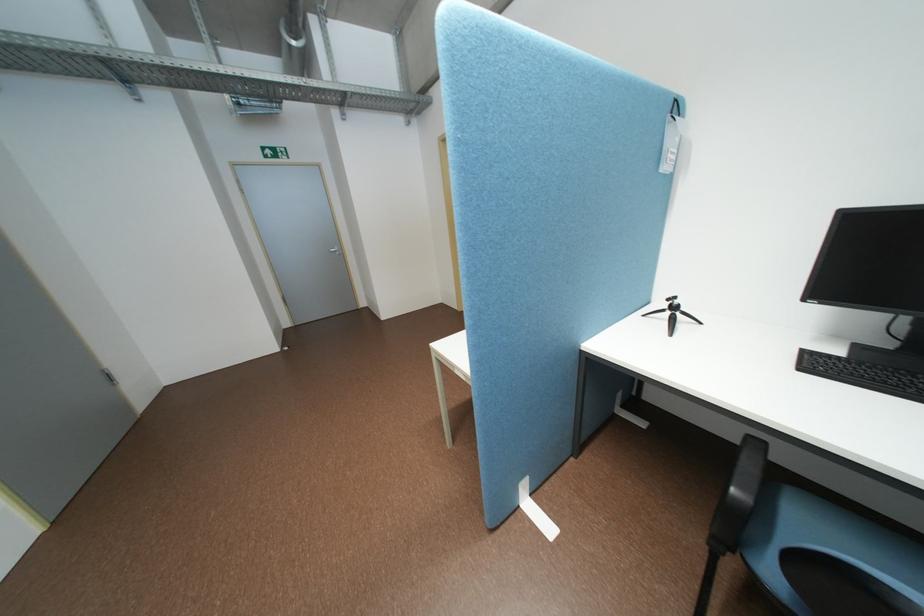
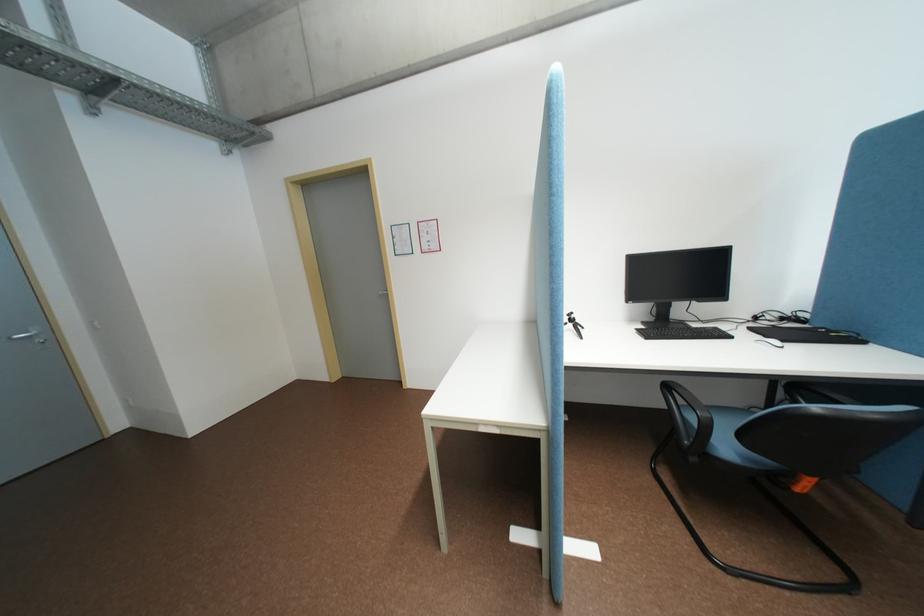
Question: How did the camera likely rotate?

Choices:
 (A) Left
 (B) Right
 (C) Up
 (D) Down

Answer: (B)